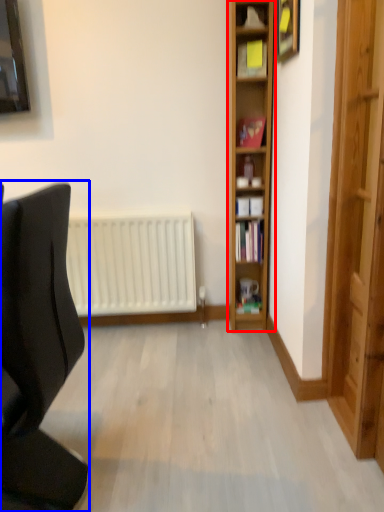
Question: Which point is closer to the camera, shelf (highlighted by a red box) or chair (highlighted by a blue box)?

Choices:
 (A) shelf
 (B) chair

Answer: (B)